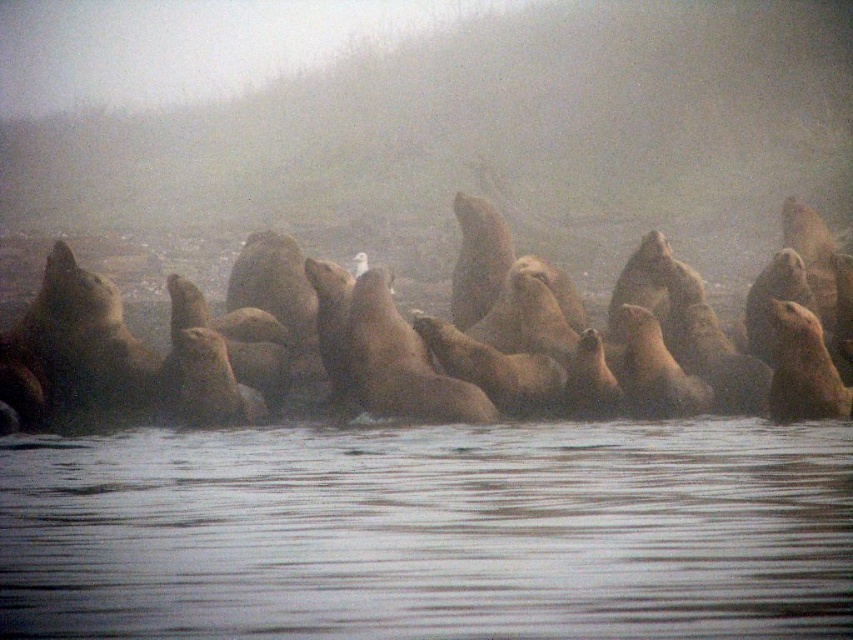
You are standing at the edge of the rocky shoreline and want to place a small buoy at the two points mentioned. Which point, point (234, 481) or point (346, 304), is closer to you where you can place the buoy more easily?

Point (234, 481) is closer to the viewer than point (346, 304), so you can place the buoy more easily at point (234, 481).

You are a photographer aiming to capture the light brown fur seal at center and the clear water at lower center in a single frame. Based on their widths, which one should you focus on first to ensure they both fit in the shot?

The clear water at lower center is wider than the light brown fur seal at center. To ensure both fit in the shot, focus on the wider clear water at lower center first, then adjust the framing to include the seal.